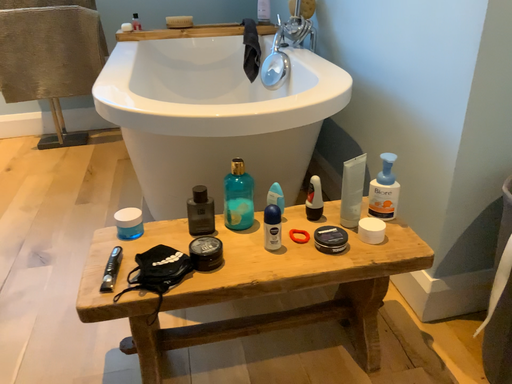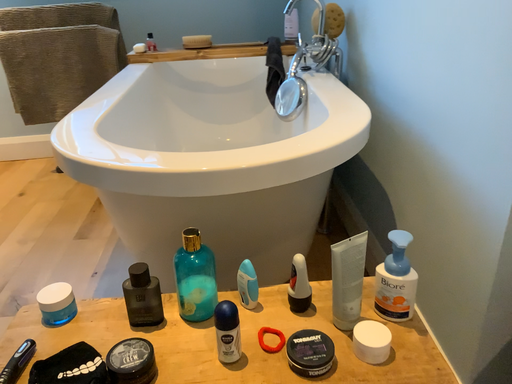
Question: Which way did the camera rotate in the video?

Choices:
 (A) rotated right
 (B) rotated left

Answer: (B)